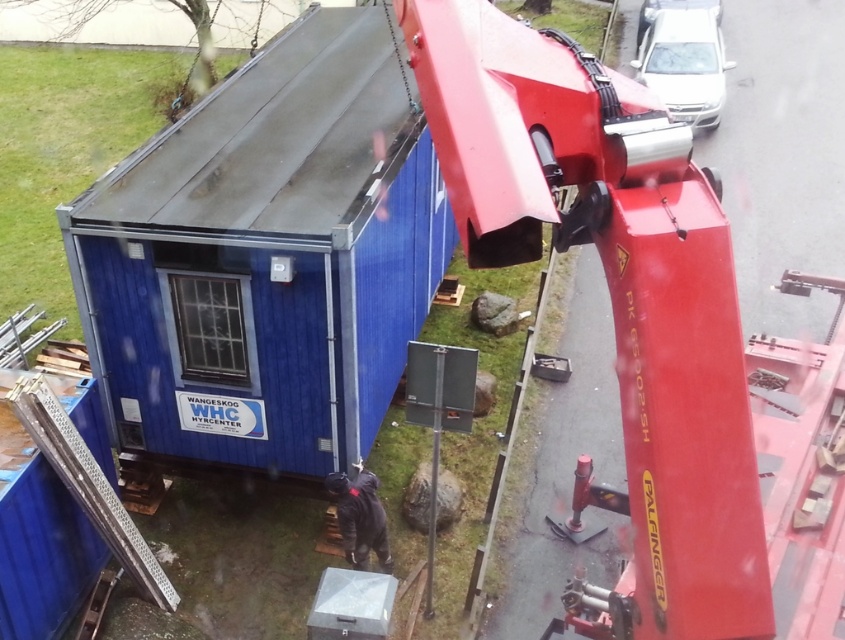
You are a delivery driver who needs to park your truck between the white glossy car at upper right and the white glossy car at upper center. Given that your truck is 2.5 meters tall, will it fit without touching the taller car?

The white glossy car at upper right is taller than the white glossy car at upper center. Since the truck is 2.5 meters tall, it depends on the height of the taller car. However, the exact height isn not provided, so we cannot determine if it will fit.

You are planning to move the blue metallic shed at center and the white glossy car at upper right into a storage area that can only accommodate items narrower than the car. Will both items fit?

The blue metallic shed at center is narrower than the white glossy car at upper right. Since the storage area can only accommodate items narrower than the car, the shed will fit, but the car itself will not.

You are planning to move the blue metallic shed at center and the white glossy car at upper right to a new location. Based on their sizes, which one would require more space in the transportation vehicle?

The white glossy car at upper right requires more space in the transportation vehicle since it is larger than the blue metallic shed at center according to the description.